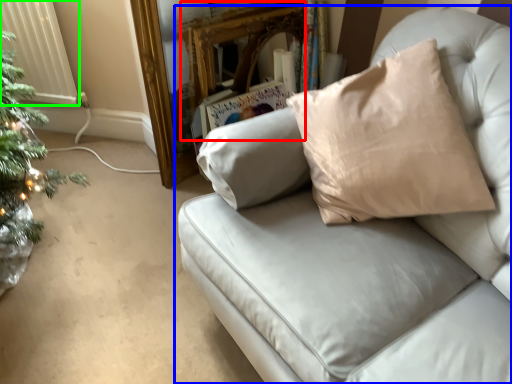
Question: Which is farther away from mirror (highlighted by a red box)? studio couch (highlighted by a blue box) or radiator (highlighted by a green box)?

Choices:
 (A) studio couch
 (B) radiator

Answer: (A)